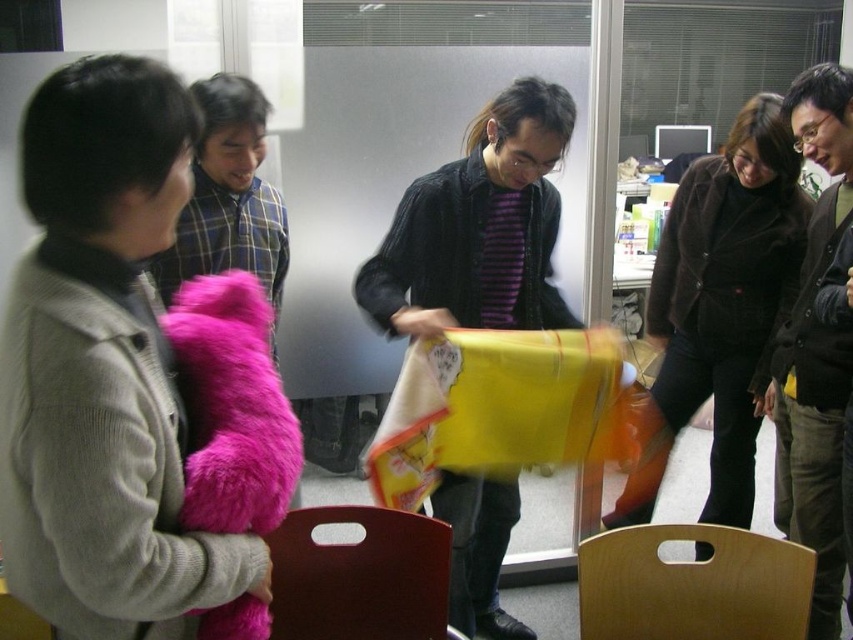
Question: Which point appears farthest from the camera in this image?

Choices:
 (A) (457, 524)
 (B) (209, 248)
 (C) (834, 186)
 (D) (206, 380)

Answer: (A)

Question: Is fuzzy pink teddy bear at left in front of plaid shirt at upper left?

Choices:
 (A) no
 (B) yes

Answer: (B)

Question: Which object appears closest to the camera in this image?

Choices:
 (A) velvet brown coat at upper right
 (B) plush pink fur at left

Answer: (B)

Question: Which object appears closest to the camera in this image?

Choices:
 (A) plush pink fur at left
 (B) plaid shirt at upper left
 (C) purple striped sweater at center

Answer: (A)

Question: Can you confirm if velvet brown coat at upper right is wider than plaid shirt at upper left?

Choices:
 (A) no
 (B) yes

Answer: (B)

Question: From the image, what is the correct spatial relationship of purple striped sweater at center in relation to fuzzy pink teddy bear at left?

Choices:
 (A) above
 (B) below

Answer: (A)